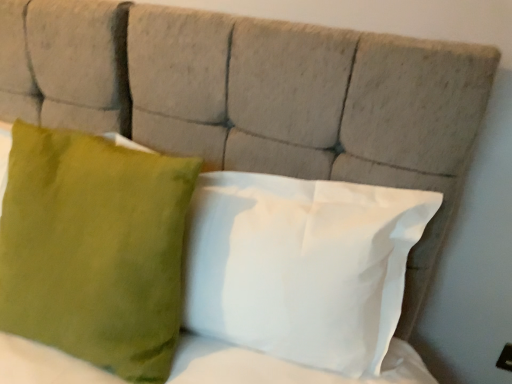
Where is `white matte pillow at center, which is the 2th pillow from left to right`? The image size is (512, 384). white matte pillow at center, which is the 2th pillow from left to right is located at coordinates (301, 266).

What do you see at coordinates (301, 266) in the screenshot? Image resolution: width=512 pixels, height=384 pixels. I see `white matte pillow at center, which is the 2th pillow from left to right` at bounding box center [301, 266].

In order to face green velvet pillow at left, which appears as the second pillow when viewed from the right, should I rotate leftwards or rightwards?

You should look left and rotate roughly 22.658 degrees.

This screenshot has height=384, width=512. What do you see at coordinates (94, 249) in the screenshot?
I see `green velvet pillow at left, which appears as the second pillow when viewed from the right` at bounding box center [94, 249].

Identify the location of green velvet pillow at left, which ranks as the first pillow in left-to-right order. (94, 249).

What are the coordinates of `white matte pillow at center, acting as the 1th pillow starting from the right` in the screenshot? It's located at (301, 266).

Would you say white matte pillow at center, which is the 2th pillow from left to right, is to the left or to the right of green velvet pillow at left, which ranks as the first pillow in left-to-right order, in the picture?

In the image, white matte pillow at center, which is the 2th pillow from left to right, appears on the right side of green velvet pillow at left, which ranks as the first pillow in left-to-right order.

Is the position of white matte pillow at center, acting as the 1th pillow starting from the right, less distant than that of green velvet pillow at left, which ranks as the first pillow in left-to-right order?

That is False.

Which point is more distant from viewer, (304, 247) or (156, 164)?

The point (156, 164) is behind.

From the image's perspective, is white matte pillow at center, which is the 2th pillow from left to right, on green velvet pillow at left, which ranks as the first pillow in left-to-right order?

No, from the image's perspective, white matte pillow at center, which is the 2th pillow from left to right, is not above green velvet pillow at left, which ranks as the first pillow in left-to-right order.

From a real-world perspective, does white matte pillow at center, which is the 2th pillow from left to right, stand above green velvet pillow at left, which appears as the second pillow when viewed from the right?

Correct, in the physical world, white matte pillow at center, which is the 2th pillow from left to right, is higher than green velvet pillow at left, which appears as the second pillow when viewed from the right.

Between white matte pillow at center, which is the 2th pillow from left to right, and green velvet pillow at left, which ranks as the first pillow in left-to-right order, which one has smaller width?

Thinner between the two is white matte pillow at center, which is the 2th pillow from left to right.

Considering the sizes of objects white matte pillow at center, which is the 2th pillow from left to right, and green velvet pillow at left, which ranks as the first pillow in left-to-right order, in the image provided, who is taller, white matte pillow at center, which is the 2th pillow from left to right, or green velvet pillow at left, which ranks as the first pillow in left-to-right order,?

Standing taller between the two is green velvet pillow at left, which ranks as the first pillow in left-to-right order.

Between white matte pillow at center, acting as the 1th pillow starting from the right, and green velvet pillow at left, which ranks as the first pillow in left-to-right order, which one has smaller size?

With smaller size is white matte pillow at center, acting as the 1th pillow starting from the right.

Could green velvet pillow at left, which appears as the second pillow when viewed from the right, be considered to be inside white matte pillow at center, which is the 2th pillow from left to right?

No, green velvet pillow at left, which appears as the second pillow when viewed from the right, is not a part of white matte pillow at center, which is the 2th pillow from left to right.

Is white matte pillow at center, acting as the 1th pillow starting from the right, placed right next to green velvet pillow at left, which ranks as the first pillow in left-to-right order?

No, white matte pillow at center, acting as the 1th pillow starting from the right, is not making contact with green velvet pillow at left, which ranks as the first pillow in left-to-right order.

Is white matte pillow at center, which is the 2th pillow from left to right, positioned with its back to green velvet pillow at left, which appears as the second pillow when viewed from the right?

No, white matte pillow at center, which is the 2th pillow from left to right, is not facing the opposite direction of green velvet pillow at left, which appears as the second pillow when viewed from the right.

How different are the orientations of white matte pillow at center, which is the 2th pillow from left to right, and green velvet pillow at left, which ranks as the first pillow in left-to-right order, in degrees?

They differ by 3.31 degrees in their facing directions.

Where is `pillow below the green velvet pillow at left, which appears as the second pillow when viewed from the right (from the image's perspective)`? pillow below the green velvet pillow at left, which appears as the second pillow when viewed from the right (from the image's perspective) is located at coordinates (301, 266).

Which object is positioned more to the right, green velvet pillow at left, which appears as the second pillow when viewed from the right, or white matte pillow at center, acting as the 1th pillow starting from the right?

Positioned to the right is white matte pillow at center, acting as the 1th pillow starting from the right.

Which object is closer to the camera, green velvet pillow at left, which ranks as the first pillow in left-to-right order, or white matte pillow at center, which is the 2th pillow from left to right?

Positioned in front is green velvet pillow at left, which ranks as the first pillow in left-to-right order.

Which is behind, point (191, 191) or point (243, 182)?

Positioned behind is point (243, 182).

From the image's perspective, which one is positioned higher, green velvet pillow at left, which ranks as the first pillow in left-to-right order, or white matte pillow at center, which is the 2th pillow from left to right?

green velvet pillow at left, which ranks as the first pillow in left-to-right order, appears higher in the image.

From a real-world perspective, relative to white matte pillow at center, which is the 2th pillow from left to right, is green velvet pillow at left, which appears as the second pillow when viewed from the right, vertically above or below?

In terms of real-world spatial position, green velvet pillow at left, which appears as the second pillow when viewed from the right, is below white matte pillow at center, which is the 2th pillow from left to right.

In the scene shown: Considering the relative sizes of green velvet pillow at left, which ranks as the first pillow in left-to-right order, and white matte pillow at center, acting as the 1th pillow starting from the right, in the image provided, is green velvet pillow at left, which ranks as the first pillow in left-to-right order, thinner than white matte pillow at center, acting as the 1th pillow starting from the right,?

No, green velvet pillow at left, which ranks as the first pillow in left-to-right order, is not thinner than white matte pillow at center, acting as the 1th pillow starting from the right.

Considering the relative sizes of green velvet pillow at left, which ranks as the first pillow in left-to-right order, and white matte pillow at center, acting as the 1th pillow starting from the right, in the image provided, is green velvet pillow at left, which ranks as the first pillow in left-to-right order, taller than white matte pillow at center, acting as the 1th pillow starting from the right,?

Yes, green velvet pillow at left, which ranks as the first pillow in left-to-right order, is taller than white matte pillow at center, acting as the 1th pillow starting from the right.

Who is smaller, green velvet pillow at left, which ranks as the first pillow in left-to-right order, or white matte pillow at center, acting as the 1th pillow starting from the right?

With smaller size is white matte pillow at center, acting as the 1th pillow starting from the right.

Is green velvet pillow at left, which ranks as the first pillow in left-to-right order, inside the boundaries of white matte pillow at center, which is the 2th pillow from left to right, or outside?

The correct answer is: outside.

Is the surface of green velvet pillow at left, which appears as the second pillow when viewed from the right, in direct contact with white matte pillow at center, acting as the 1th pillow starting from the right?

No, green velvet pillow at left, which appears as the second pillow when viewed from the right, is not beside white matte pillow at center, acting as the 1th pillow starting from the right.

Is green velvet pillow at left, which appears as the second pillow when viewed from the right, facing away from white matte pillow at center, which is the 2th pillow from left to right?

That's not correct — green velvet pillow at left, which appears as the second pillow when viewed from the right, is not looking away from white matte pillow at center, which is the 2th pillow from left to right.

Based on the photo, how different are the orientations of green velvet pillow at left, which ranks as the first pillow in left-to-right order, and white matte pillow at center, acting as the 1th pillow starting from the right, in degrees?

The angular difference between green velvet pillow at left, which ranks as the first pillow in left-to-right order, and white matte pillow at center, acting as the 1th pillow starting from the right, is 3.31 degrees.

This screenshot has width=512, height=384. Identify the location of pillow that is in front of the white matte pillow at center, which is the 2th pillow from left to right. (94, 249).

Find the location of a particular element. pillow below the green velvet pillow at left, which appears as the second pillow when viewed from the right (from the image's perspective) is located at coordinates (301, 266).

You are a GUI agent. You are given a task and a screenshot of the screen. Output one action in this format:
    pyautogui.click(x=<x>, y=<y>)
    Task: Click on the pillow behind the green velvet pillow at left, which appears as the second pillow when viewed from the right
    The image size is (512, 384).
    Given the screenshot: What is the action you would take?
    pyautogui.click(x=301, y=266)